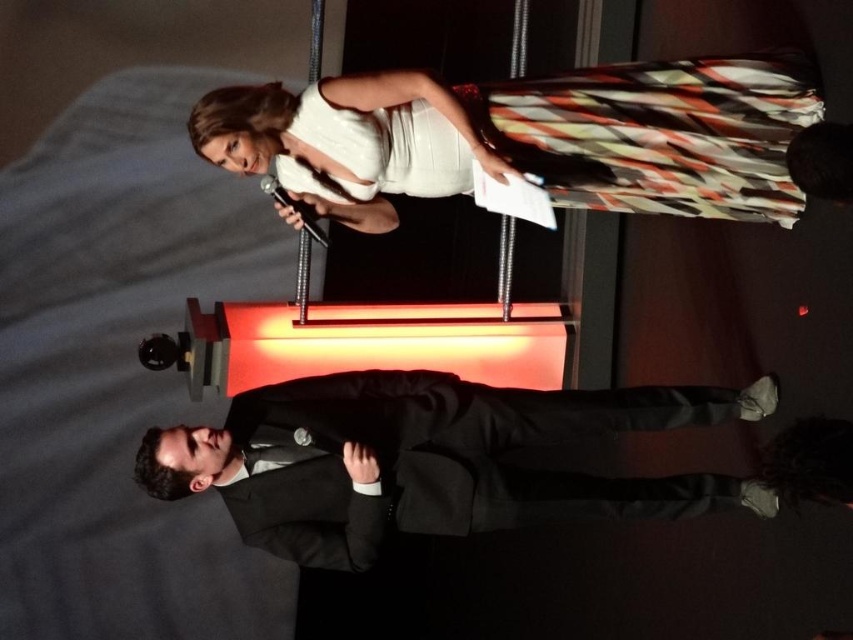
You are an event planner standing at the back of the stage. You need to hand a note to the person in the black woolen suit at center without disturbing the speaker in the white satin dress at upper center. Can you approach directly from behind the podium? Explain your reasoning based on their positions.

The white satin dress at upper center is closer to the viewer than the black woolen suit at center, so the speaker is blocking the direct path to the black woolen suit at center. Therefore, approaching directly from behind the podium might not be possible without passing in front of the speaker, which could disturb them.

You are an event planner trying to arrange a photo shoot for the formal event. You need to position a photographer to capture both the white satin dress at upper center and the black woolen suit at center in the same frame. Based on their positions, where should the photographer stand relative to the two individuals?

The photographer should position themselves to the left of both the white satin dress at upper center and the black woolen suit at center. Since the white satin dress at upper center is to the right of the black woolen suit at center, placing the photographer to the left would ensure both are visible in the frame.